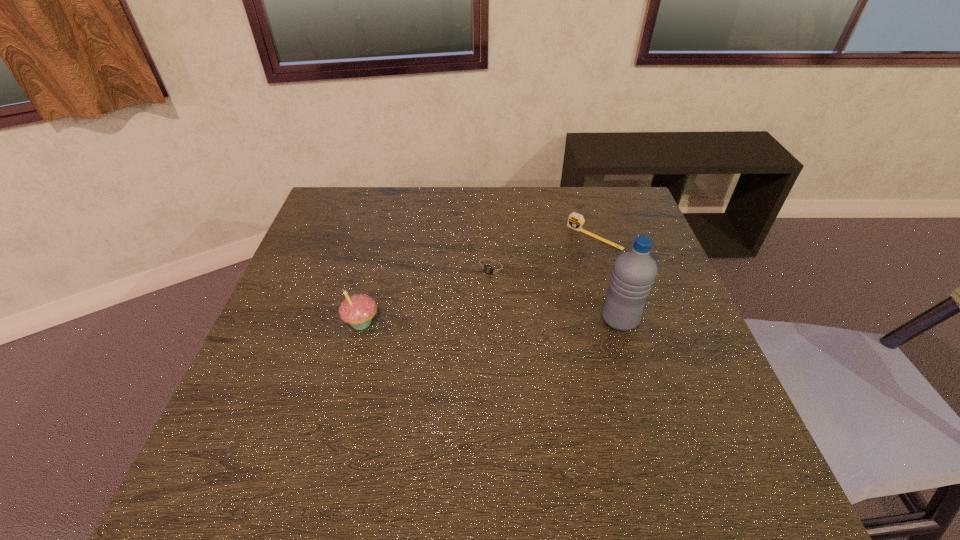
You are a GUI agent. You are given a task and a screenshot of the screen. Output one action in this format:
    pyautogui.click(x=<x>, y=<y>)
    Task: Click on the vacant region between the second shortest object and the water bottle
    
    Given the screenshot: What is the action you would take?
    [607, 278]

You are a GUI agent. You are given a task and a screenshot of the screen. Output one action in this format:
    pyautogui.click(x=<x>, y=<y>)
    Task: Click on the empty space between the watch and the cupcake
    The height and width of the screenshot is (540, 960).
    Given the screenshot: What is the action you would take?
    click(x=427, y=295)

You are a GUI agent. You are given a task and a screenshot of the screen. Output one action in this format:
    pyautogui.click(x=<x>, y=<y>)
    Task: Click on the third closest object to the tallest object
    
    Given the screenshot: What is the action you would take?
    (357, 310)

You are a GUI agent. You are given a task and a screenshot of the screen. Output one action in this format:
    pyautogui.click(x=<x>, y=<y>)
    Task: Click on the object that stands as the second closest to the tallest object
    The width and height of the screenshot is (960, 540).
    Given the screenshot: What is the action you would take?
    pyautogui.click(x=575, y=221)

Where is `vacant space that satisfies the following two spatial constraints: 1. on the front side of the water bottle; 2. on the left side of the third nearest object`? The image size is (960, 540). vacant space that satisfies the following two spatial constraints: 1. on the front side of the water bottle; 2. on the left side of the third nearest object is located at coordinates (494, 320).

Identify the location of vacant space that satisfies the following two spatial constraints: 1. on the back side of the farthest object; 2. on the left side of the tallest object. The height and width of the screenshot is (540, 960). (594, 237).

You are a GUI agent. You are given a task and a screenshot of the screen. Output one action in this format:
    pyautogui.click(x=<x>, y=<y>)
    Task: Click on the free space in the image that satisfies the following two spatial constraints: 1. on the back side of the tape measure; 2. on the right side of the tallest object
    The height and width of the screenshot is (540, 960).
    Given the screenshot: What is the action you would take?
    pyautogui.click(x=594, y=237)

Find the location of a particular element. free region that satisfies the following two spatial constraints: 1. on the back side of the tape measure; 2. on the right side of the leftmost object is located at coordinates (384, 237).